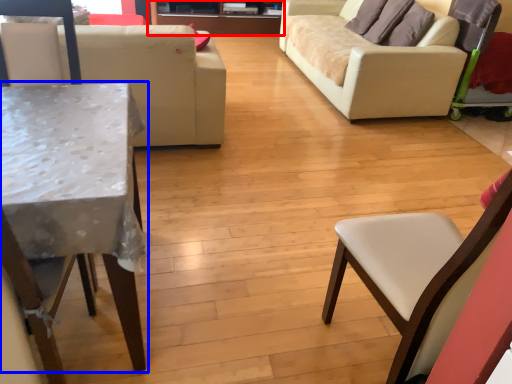
Question: Which object appears closest to the camera in this image, entertainment center (highlighted by a red box) or table (highlighted by a blue box)?

Choices:
 (A) entertainment center
 (B) table

Answer: (B)